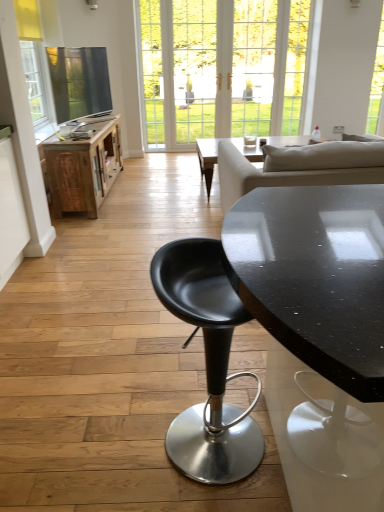
Locate an element on the screen. The width and height of the screenshot is (384, 512). wooden cabinet at left is located at coordinates (84, 168).

What do you see at coordinates (84, 168) in the screenshot? The width and height of the screenshot is (384, 512). I see `wooden cabinet at left` at bounding box center [84, 168].

Find the location of `black matte stool at center`. black matte stool at center is located at coordinates (207, 364).

The image size is (384, 512). What do you see at coordinates (207, 364) in the screenshot? I see `black matte stool at center` at bounding box center [207, 364].

What is the approximate width of black matte stool at center?

15.30 inches.

Locate an element on the screen. wooden cabinet at left is located at coordinates (84, 168).

Is black matte stool at center to the left or to the right of wooden cabinet at left in the image?

black matte stool at center is positioned on wooden cabinet at left's right side.

In the scene shown: Considering the relative positions of black matte stool at center and wooden cabinet at left in the image provided, is black matte stool at center behind wooden cabinet at left?

No, the depth of black matte stool at center is less than that of wooden cabinet at left.

Considering the positions of point (204, 298) and point (61, 191), is point (204, 298) closer or farther from the camera than point (61, 191)?

Point (204, 298) is closer to the camera than point (61, 191).

From the image's perspective, is black matte stool at center over wooden cabinet at left?

Incorrect, from the image's perspective, black matte stool at center is lower than wooden cabinet at left.

Consider the image. From a real-world perspective, which object rests below the other?

wooden cabinet at left, from a real-world perspective.

Can you confirm if black matte stool at center is thinner than wooden cabinet at left?

Yes, black matte stool at center is thinner than wooden cabinet at left.

Can you confirm if black matte stool at center is taller than wooden cabinet at left?

Yes.

Which of these two, black matte stool at center or wooden cabinet at left, is smaller?

Smaller between the two is black matte stool at center.

Which is correct: black matte stool at center is inside wooden cabinet at left, or outside of it?

black matte stool at center exists outside the volume of wooden cabinet at left.

Are black matte stool at center and wooden cabinet at left far apart?

Indeed, black matte stool at center is not near wooden cabinet at left.

Is black matte stool at center oriented towards wooden cabinet at left?

No, black matte stool at center is not turned towards wooden cabinet at left.

Measure the distance from black matte stool at center to wooden cabinet at left.

The distance of black matte stool at center from wooden cabinet at left is 8.54 feet.

Identify the location of chair in front of the wooden cabinet at left. This screenshot has height=512, width=384. (207, 364).

Does wooden cabinet at left appear on the right side of black matte stool at center?

In fact, wooden cabinet at left is to the left of black matte stool at center.

Considering the relative positions of wooden cabinet at left and black matte stool at center in the image provided, is wooden cabinet at left behind black matte stool at center?

Yes, it is.

Which point is more distant from viewer, [85,142] or [190,452]?

The point [85,142] is more distant.

From the image's perspective, which one is positioned higher, wooden cabinet at left or black matte stool at center?

wooden cabinet at left appears higher in the image.

From a real-world perspective, relative to black matte stool at center, is wooden cabinet at left vertically above or below?

In terms of real-world spatial position, wooden cabinet at left is below black matte stool at center.

Does wooden cabinet at left have a lesser width compared to black matte stool at center?

Incorrect, the width of wooden cabinet at left is not less than that of black matte stool at center.

Considering the relative sizes of wooden cabinet at left and black matte stool at center in the image provided, is wooden cabinet at left taller than black matte stool at center?

Incorrect, the height of wooden cabinet at left is not larger of that of black matte stool at center.

Is wooden cabinet at left bigger than black matte stool at center?

Indeed, wooden cabinet at left has a larger size compared to black matte stool at center.

Consider the image. Is wooden cabinet at left not inside black matte stool at center?

Indeed, wooden cabinet at left is completely outside black matte stool at center.

Is there a large distance between wooden cabinet at left and black matte stool at center?

wooden cabinet at left is positioned a significant distance from black matte stool at center.

In the scene shown: Is wooden cabinet at left looking in the opposite direction of black matte stool at center?

No, wooden cabinet at left is not facing away from black matte stool at center.

Find the location of `chair lying on the right of wooden cabinet at left`. chair lying on the right of wooden cabinet at left is located at coordinates (207, 364).

Find the location of a particular element. table below the black matte stool at center (from a real-world perspective) is located at coordinates (84, 168).

I want to click on chair above the wooden cabinet at left (from a real-world perspective), so click(x=207, y=364).